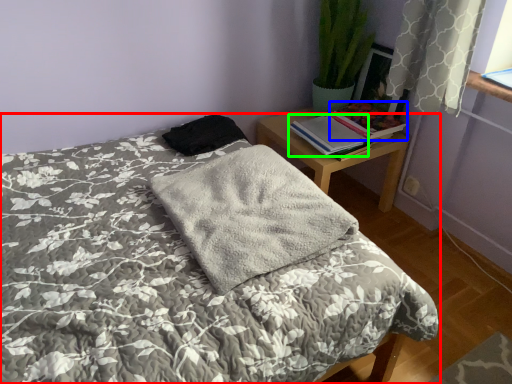
Question: Based on their relative distances, which object is farther from bed (highlighted by a red box)? Choose from book (highlighted by a blue box) and book (highlighted by a green box).

Choices:
 (A) book
 (B) book

Answer: (A)